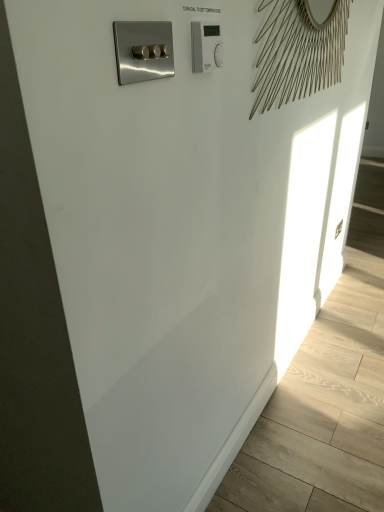
Question: Could you tell me if satin nickel switch at upper left is facing white plastic thermostat at upper right?

Choices:
 (A) no
 (B) yes

Answer: (A)

Question: Considering the relative sizes of satin nickel switch at upper left and white plastic thermostat at upper right in the image provided, is satin nickel switch at upper left taller than white plastic thermostat at upper right?

Choices:
 (A) yes
 (B) no

Answer: (B)

Question: Is satin nickel switch at upper left placed right next to white plastic thermostat at upper right?

Choices:
 (A) yes
 (B) no

Answer: (B)

Question: Would you say satin nickel switch at upper left is outside white plastic thermostat at upper right?

Choices:
 (A) yes
 (B) no

Answer: (A)

Question: From the image's perspective, is satin nickel switch at upper left below white plastic thermostat at upper right?

Choices:
 (A) yes
 (B) no

Answer: (A)

Question: Are satin nickel switch at upper left and white plastic thermostat at upper right located far from each other?

Choices:
 (A) no
 (B) yes

Answer: (A)

Question: Is white plastic thermostat at upper right oriented towards satin nickel switch at upper left?

Choices:
 (A) yes
 (B) no

Answer: (B)

Question: From a real-world perspective, does white plastic thermostat at upper right sit lower than satin nickel switch at upper left?

Choices:
 (A) yes
 (B) no

Answer: (B)

Question: Can you confirm if white plastic thermostat at upper right is wider than satin nickel switch at upper left?

Choices:
 (A) no
 (B) yes

Answer: (B)

Question: Are white plastic thermostat at upper right and satin nickel switch at upper left located far from each other?

Choices:
 (A) no
 (B) yes

Answer: (A)

Question: From a real-world perspective, does white plastic thermostat at upper right stand above satin nickel switch at upper left?

Choices:
 (A) no
 (B) yes

Answer: (B)

Question: From the image's perspective, would you say white plastic thermostat at upper right is positioned over satin nickel switch at upper left?

Choices:
 (A) no
 (B) yes

Answer: (B)

Question: Looking at the image, does satin nickel switch at upper left seem bigger or smaller compared to white plastic thermostat at upper right?

Choices:
 (A) big
 (B) small

Answer: (A)